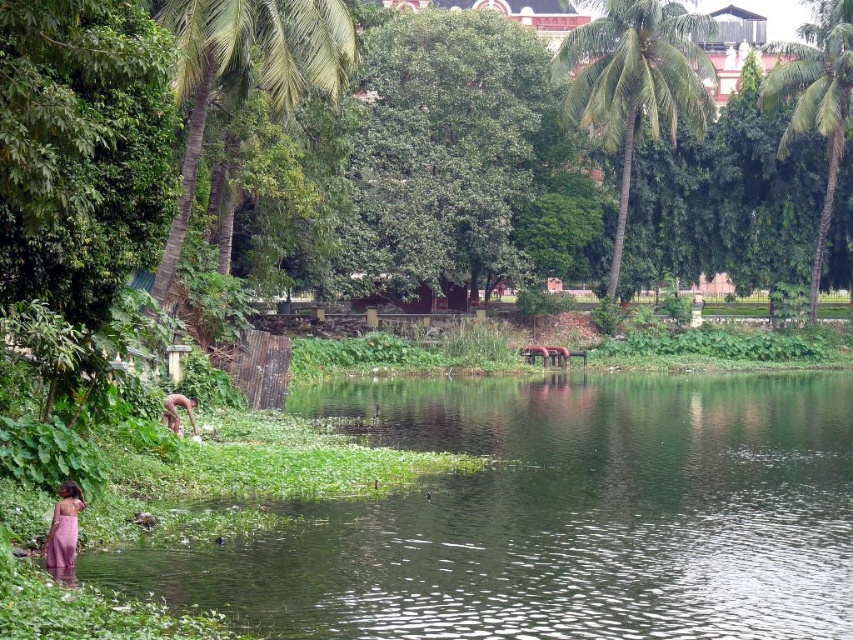
You are a photographer planning to take a photo of the green leafy palm tree at upper right and the brown fabric person at lower left. Based on their positions, which object is located to the right of the other?

The green leafy palm tree at upper right is positioned on the right side of brown fabric person at lower left.

You are a photographer planning to take a photo of the green leafy palm tree at upper right and the pink fabric dress at lower left. Based on their positions, which object is located to the right of the other?

The green leafy palm tree at upper right is positioned on the right side of pink fabric dress at lower left.

You are planning to take a photo of the pink fabric dress at lower left and the green leafy palm tree at upper left. Which object will occupy more space in the photo frame?

The green leafy palm tree at upper left will occupy more space in the photo frame because its width is larger than the pink fabric dress at lower left.